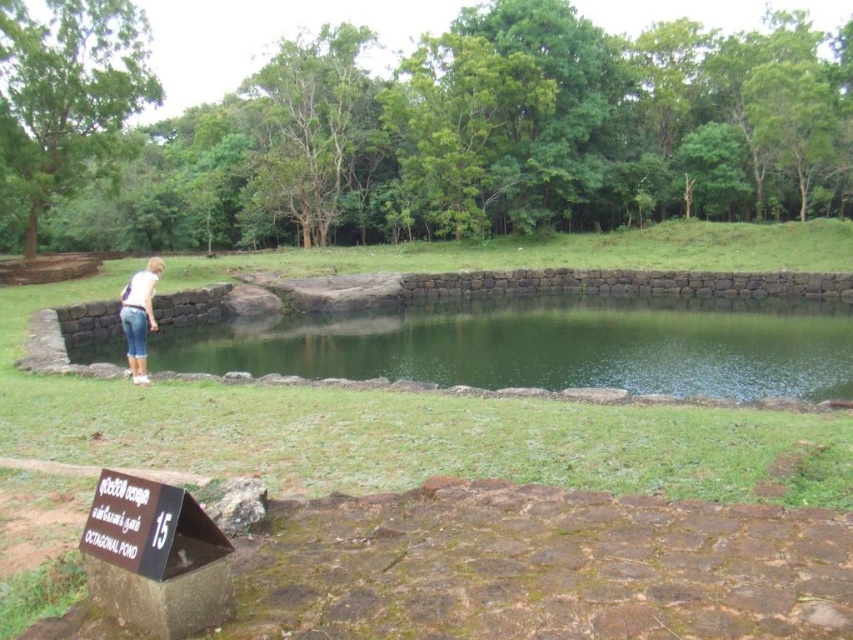
Which is behind, point (369, 337) or point (141, 368)?

Positioned behind is point (369, 337).

Can you confirm if green smooth water at center is wider than denim shorts at lower left?

Indeed, green smooth water at center has a greater width compared to denim shorts at lower left.

Where is `green smooth water at center`? Image resolution: width=853 pixels, height=640 pixels. green smooth water at center is located at coordinates (543, 346).